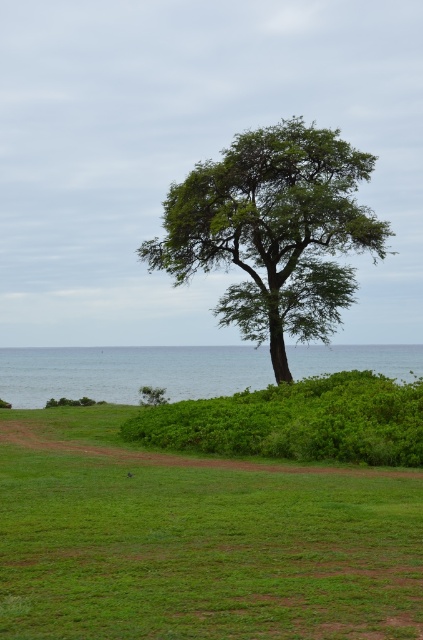
Question: Can you confirm if green grassy field at center is positioned to the left of blue water at lower left?

Choices:
 (A) no
 (B) yes

Answer: (B)

Question: Based on their relative distances, which object is farther from the green leafy tree at center?

Choices:
 (A) green grassy field at center
 (B) blue water at lower left

Answer: (B)

Question: Does green leafy tree at center appear over blue water at lower left?

Choices:
 (A) no
 (B) yes

Answer: (B)

Question: Which of the following is the closest to the observer?

Choices:
 (A) green leafy tree at center
 (B) green grassy field at center

Answer: (B)

Question: Is green grassy field at center in front of green leafy tree at center?

Choices:
 (A) no
 (B) yes

Answer: (B)

Question: Which point is closer to the camera?

Choices:
 (A) blue water at lower left
 (B) green leafy tree at center

Answer: (A)